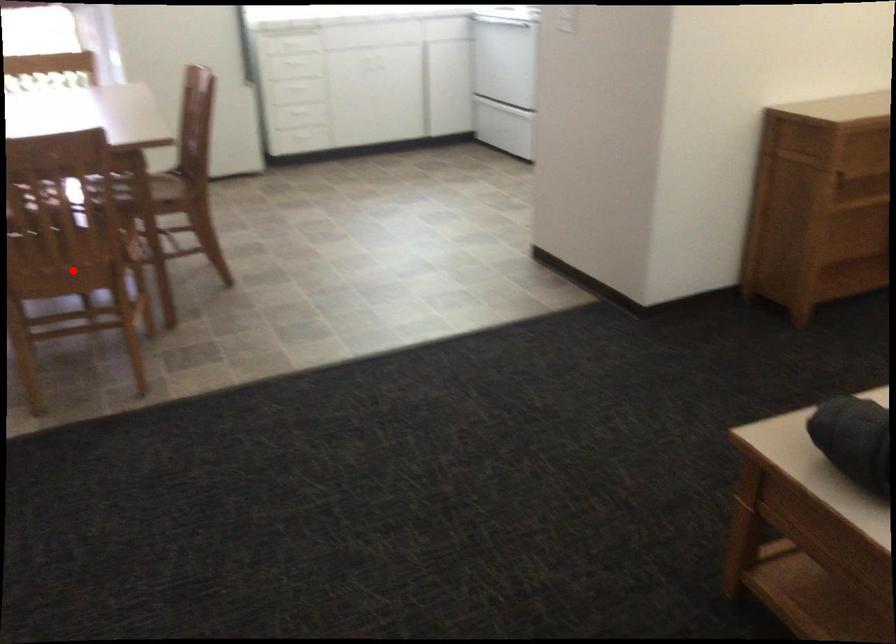
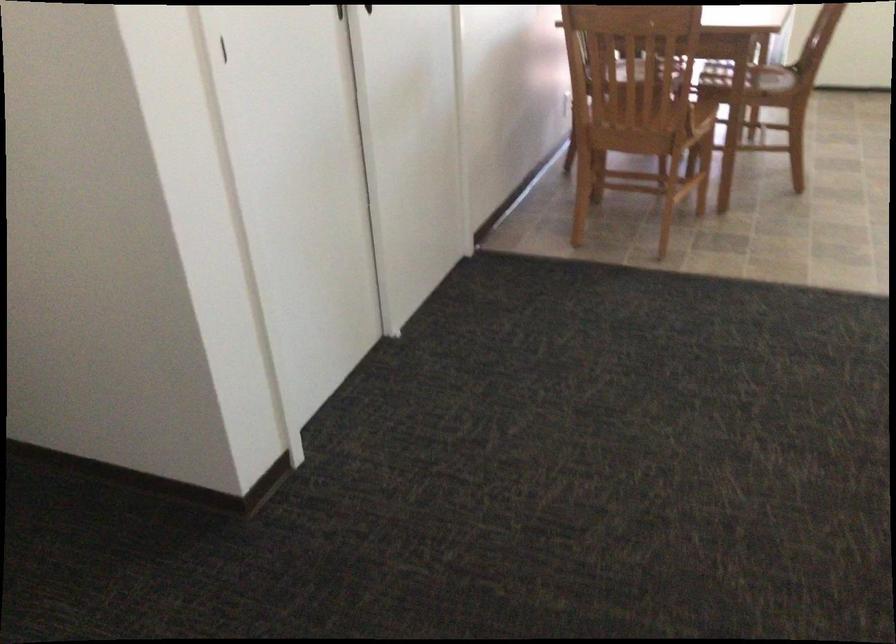
Question: I am providing you with two images of the same scene from different viewpoints. In image1, a red point is highlighted. Considering the same 3D point in image2, which of the following is correct?

Choices:
 (A) It is closer
 (B) It is farther

Answer: (B)